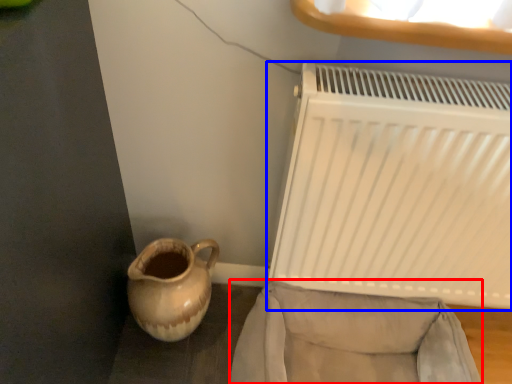
Question: Which of the following is the farthest to the observer, armchair (highlighted by a red box) or radiator (highlighted by a blue box)?

Choices:
 (A) armchair
 (B) radiator

Answer: (A)